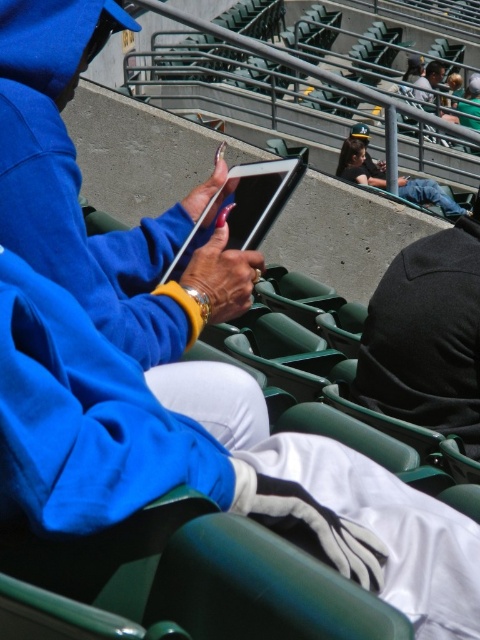
You are a photographer positioned at the front of the stadium and want to capture a closeup of the matte black tablet at center without the dark gray fabric jacket at center blocking the view. Is the tablet visible from your position?

The dark gray fabric jacket at center is taller than the matte black tablet at center, so the tablet may be partially or fully obscured by the jacket depending on the angle and distance. Adjust your position to ensure the tablet is not blocked by the jacket.

Please look at the point marked at coordinates (427,336). What object is located there?

The point at coordinates (427,336) indicates the dark gray fabric jacket at center.